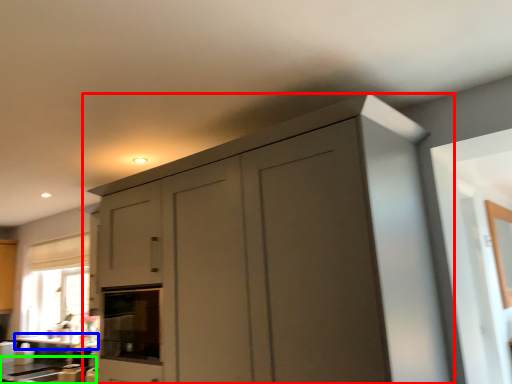
Question: Which object is the closest to the cupboard (highlighted by a red box)? Choose among these: counter top (highlighted by a blue box) or counter top (highlighted by a green box).

Choices:
 (A) counter top
 (B) counter top

Answer: (B)